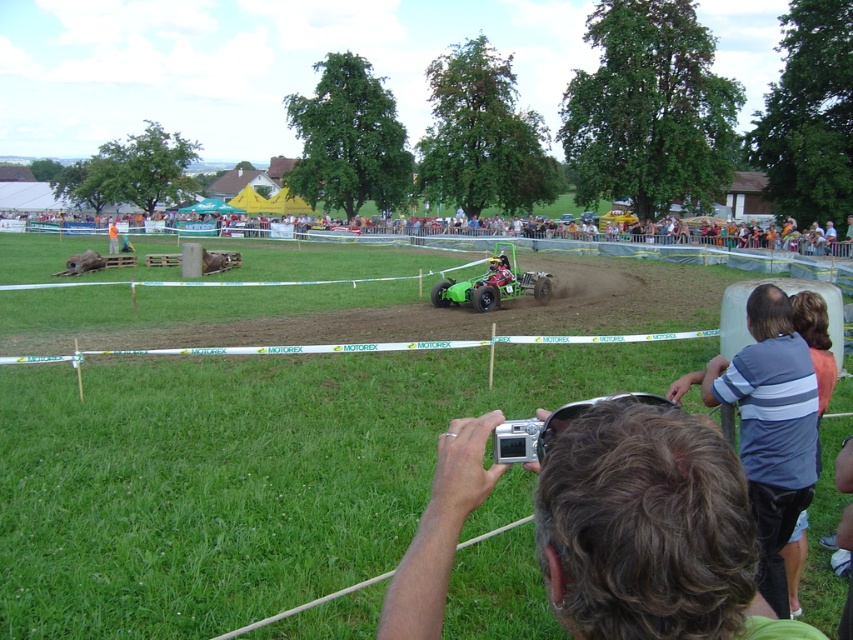
Describe the element at coordinates (648, 531) in the screenshot. I see `gray hair at lower center` at that location.

Between gray hair at lower center and green plastic chairs at upper center, which one has more height?

green plastic chairs at upper center

Measure the distance between point (643,572) and camera.

37.50 inches

Identify the location of gray hair at lower center. The width and height of the screenshot is (853, 640). (648, 531).

Can you confirm if striped cotton shirt at lower right is taller than green plastic chairs at upper center?

In fact, striped cotton shirt at lower right may be shorter than green plastic chairs at upper center.

Is point (798, 499) positioned after point (474, 236)?

No, (798, 499) is in front of (474, 236).

Who is more distant from viewer, [804,456] or [792,241]?

Positioned behind is point [792,241].

Where is `striped cotton shirt at lower right`? This screenshot has height=640, width=853. striped cotton shirt at lower right is located at coordinates (769, 426).

Does gray hair at lower center appear over striped cotton shirt at lower right?

Indeed, gray hair at lower center is positioned over striped cotton shirt at lower right.

What do you see at coordinates (648, 531) in the screenshot? The image size is (853, 640). I see `gray hair at lower center` at bounding box center [648, 531].

The width and height of the screenshot is (853, 640). Describe the element at coordinates (648, 531) in the screenshot. I see `gray hair at lower center` at that location.

In order to click on gray hair at lower center in this screenshot , I will do `click(648, 531)`.